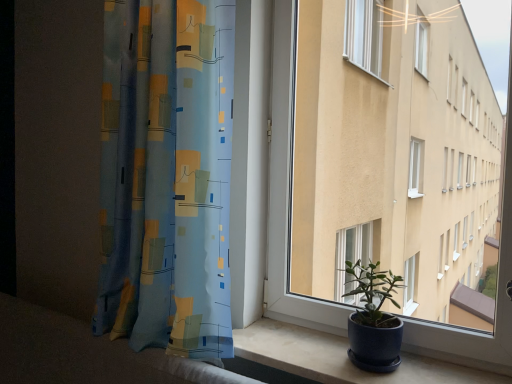
Question: Is matte white window at center wider than blue fabric curtain at left?

Choices:
 (A) no
 (B) yes

Answer: (A)

Question: Does matte white window at center have a smaller size compared to blue fabric curtain at left?

Choices:
 (A) no
 (B) yes

Answer: (B)

Question: Can you confirm if matte white window at center is positioned to the left of blue fabric curtain at left?

Choices:
 (A) no
 (B) yes

Answer: (A)

Question: Is matte white window at center shorter than blue fabric curtain at left?

Choices:
 (A) no
 (B) yes

Answer: (B)

Question: From the image's perspective, is matte white window at center below blue fabric curtain at left?

Choices:
 (A) no
 (B) yes

Answer: (B)

Question: Is matte blue pot at lower right wider or thinner than blue fabric curtain at left?

Choices:
 (A) wide
 (B) thin

Answer: (B)

Question: Considering the relative positions of matte blue pot at lower right and blue fabric curtain at left in the image provided, is matte blue pot at lower right to the left or to the right of blue fabric curtain at left?

Choices:
 (A) right
 (B) left

Answer: (A)

Question: In terms of height, does matte blue pot at lower right look taller or shorter compared to blue fabric curtain at left?

Choices:
 (A) tall
 (B) short

Answer: (B)

Question: Is matte blue pot at lower right spatially inside blue fabric curtain at left, or outside of it?

Choices:
 (A) inside
 (B) outside

Answer: (B)

Question: Looking at the image, does blue fabric curtain at left seem bigger or smaller compared to matte concrete window sill at lower right?

Choices:
 (A) big
 (B) small

Answer: (A)

Question: From the image's perspective, is blue fabric curtain at left located above or below matte concrete window sill at lower right?

Choices:
 (A) above
 (B) below

Answer: (A)

Question: From a real-world perspective, is blue fabric curtain at left positioned above or below matte concrete window sill at lower right?

Choices:
 (A) above
 (B) below

Answer: (A)

Question: Is blue fabric curtain at left in front of or behind matte concrete window sill at lower right in the image?

Choices:
 (A) front
 (B) behind

Answer: (B)

Question: Is matte concrete window sill at lower right inside or outside of blue fabric curtain at left?

Choices:
 (A) outside
 (B) inside

Answer: (A)

Question: Considering the positions of matte concrete window sill at lower right and blue fabric curtain at left in the image, is matte concrete window sill at lower right wider or thinner than blue fabric curtain at left?

Choices:
 (A) thin
 (B) wide

Answer: (B)